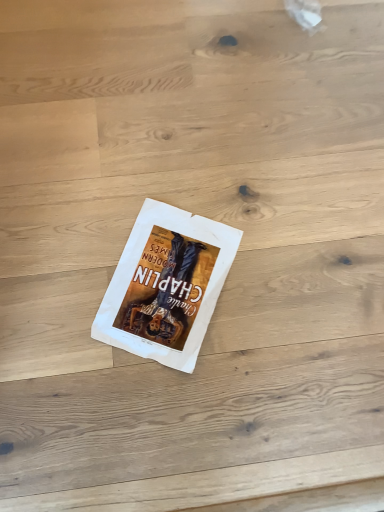
You are a GUI agent. You are given a task and a screenshot of the screen. Output one action in this format:
    pyautogui.click(x=<x>, y=<y>)
    Task: Click on the vacant point above white paper book at center (from a real-world perspective)
    
    Given the screenshot: What is the action you would take?
    pyautogui.click(x=160, y=283)